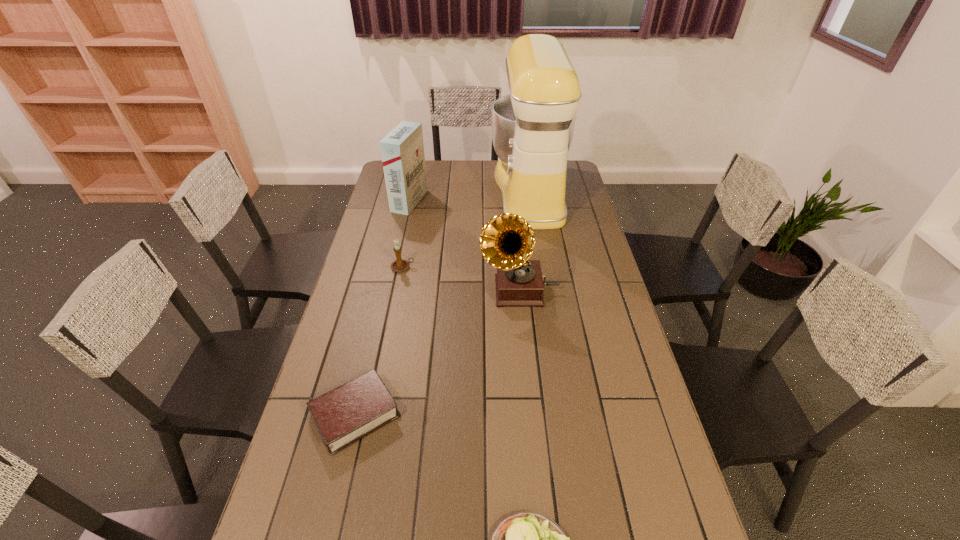
At what (x,y) coordinates should I click in order to perform the action: click on free spot located from the horn of the phonograph record. Please return your answer as a coordinate pair (x, y). Looking at the image, I should click on (377, 290).

The width and height of the screenshot is (960, 540). I want to click on free space located 0.230m from the horn of the phonograph record, so pyautogui.click(x=412, y=290).

The height and width of the screenshot is (540, 960). I want to click on vacant space situated 0.140m from the horn of the phonograph record, so tap(439, 290).

Image resolution: width=960 pixels, height=540 pixels. I want to click on free space located 0.330m on the side of the candle holder with the handle, so click(x=506, y=267).

The height and width of the screenshot is (540, 960). Identify the location of vacant space situated 0.050m on the back of the shortest object. (368, 363).

This screenshot has width=960, height=540. In order to click on object that is positioned at the far edge in this screenshot , I will do `click(532, 128)`.

Where is `cigarette case present at the left edge`? The width and height of the screenshot is (960, 540). cigarette case present at the left edge is located at coordinates (402, 150).

This screenshot has width=960, height=540. I want to click on candle holder at the left edge, so click(x=399, y=265).

This screenshot has height=540, width=960. Find the location of `Bible that is at the left edge`. Bible that is at the left edge is located at coordinates (351, 411).

At what (x,y) coordinates should I click in order to perform the action: click on object that is at the right edge. Please return your answer as a coordinate pair (x, y). This screenshot has height=540, width=960. Looking at the image, I should click on (532, 128).